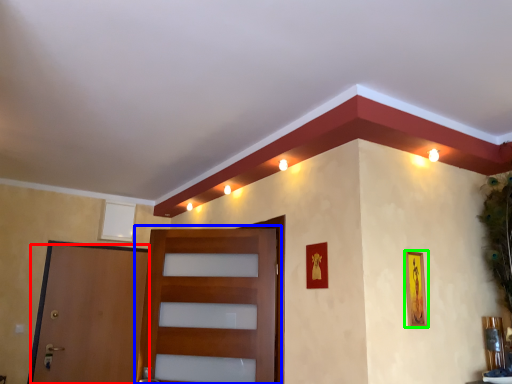
Question: Which object is positioned farthest from door (highlighted by a red box)? Select from door (highlighted by a blue box) and picture frame (highlighted by a green box).

Choices:
 (A) door
 (B) picture frame

Answer: (B)